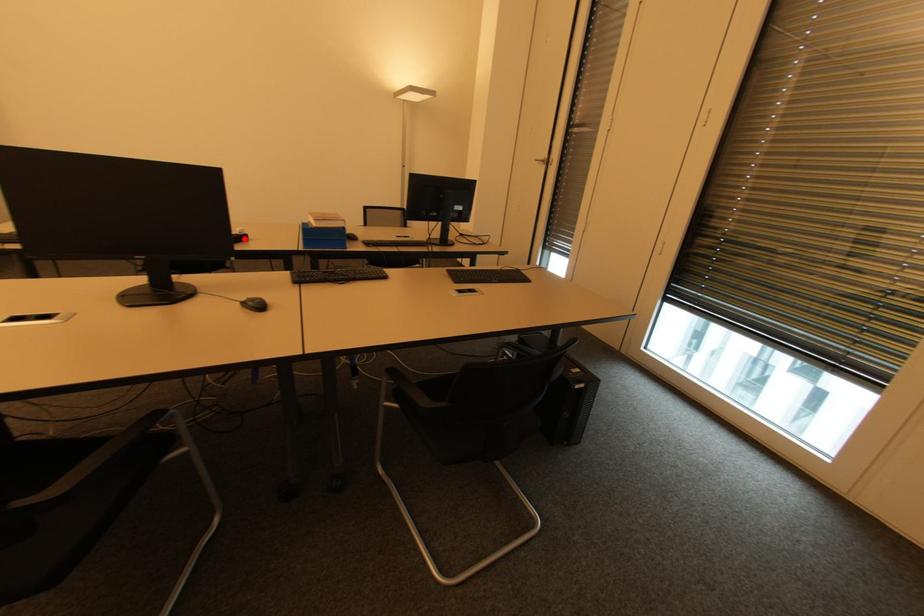
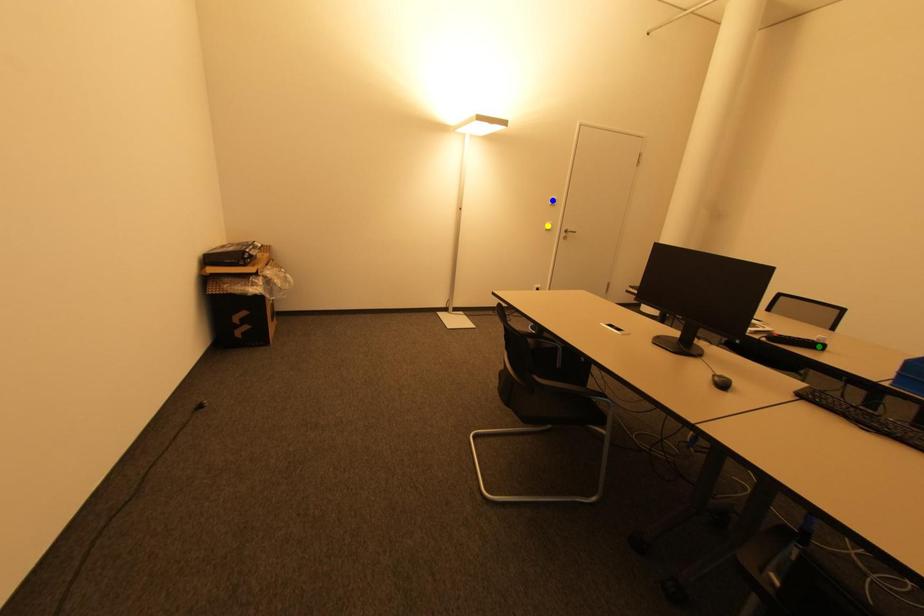
Question: I am providing you with two images of the same scene from different viewpoints. A red point is marked on the first image. You are given multiple points on the second image. Can you choose the point in image 2 that corresponds to the point in image 1?

Choices:
 (A) blue point
 (B) yellow point
 (C) green point

Answer: (C)